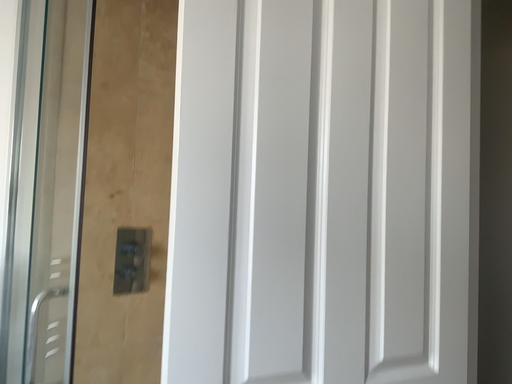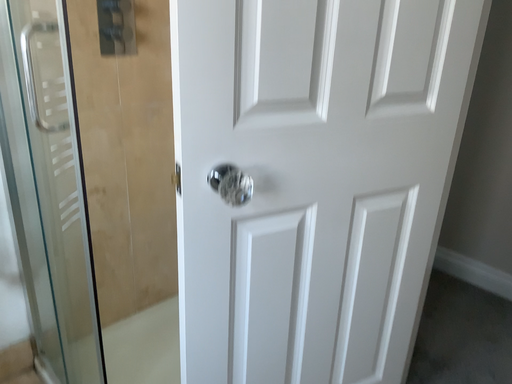
Question: How did the camera likely rotate when shooting the video?

Choices:
 (A) rotated downward
 (B) rotated upward

Answer: (A)